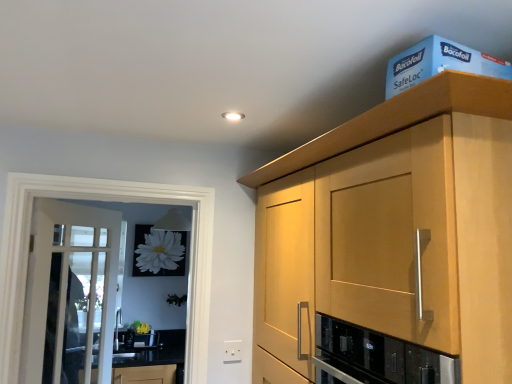
Question: Is there a large distance between light wood cabinet at upper right and blue cardboard box at upper right?

Choices:
 (A) no
 (B) yes

Answer: (A)

Question: From a real-world perspective, is light wood cabinet at upper right positioned over blue cardboard box at upper right based on gravity?

Choices:
 (A) no
 (B) yes

Answer: (A)

Question: Does light wood cabinet at upper right have a larger size compared to blue cardboard box at upper right?

Choices:
 (A) no
 (B) yes

Answer: (B)

Question: Can you confirm if light wood cabinet at upper right is shorter than blue cardboard box at upper right?

Choices:
 (A) yes
 (B) no

Answer: (B)

Question: Is light wood cabinet at upper right facing towards blue cardboard box at upper right?

Choices:
 (A) yes
 (B) no

Answer: (B)

Question: Would you say clear glass screen door at left is inside or outside white plastic electric outlet at lower center?

Choices:
 (A) outside
 (B) inside

Answer: (A)

Question: Is point pyautogui.click(x=189, y=200) positioned closer to the camera than point pyautogui.click(x=223, y=347)?

Choices:
 (A) farther
 (B) closer

Answer: (A)

Question: Looking at the image, does clear glass screen door at left seem bigger or smaller compared to white plastic electric outlet at lower center?

Choices:
 (A) small
 (B) big

Answer: (B)

Question: From a real-world perspective, relative to white plastic electric outlet at lower center, is clear glass screen door at left vertically above or below?

Choices:
 (A) above
 (B) below

Answer: (A)

Question: Is clear glass screen door at left situated inside white glass door at left or outside?

Choices:
 (A) outside
 (B) inside

Answer: (A)

Question: Considering the positions of clear glass screen door at left and white glass door at left in the image, is clear glass screen door at left bigger or smaller than white glass door at left?

Choices:
 (A) big
 (B) small

Answer: (A)

Question: Considering the positions of clear glass screen door at left and white glass door at left in the image, is clear glass screen door at left wider or thinner than white glass door at left?

Choices:
 (A) wide
 (B) thin

Answer: (A)

Question: In the image, is clear glass screen door at left positioned in front of or behind white glass door at left?

Choices:
 (A) behind
 (B) front

Answer: (B)

Question: In terms of size, does white plastic electric outlet at lower center appear bigger or smaller than black granite countertop at lower left?

Choices:
 (A) big
 (B) small

Answer: (B)

Question: Is white plastic electric outlet at lower center inside the boundaries of black granite countertop at lower left, or outside?

Choices:
 (A) outside
 (B) inside

Answer: (A)